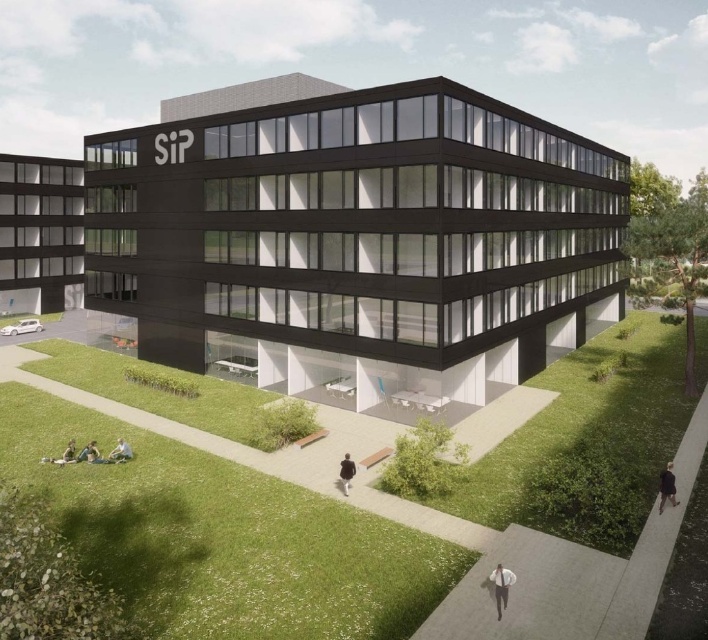
You are a window cleaner working on the black glass building at center. You need to reach the top of the green fabric at lower left to clean a window. Will you need a ladder to reach that height?

The black glass building at center is taller than the green fabric at lower left, so the window at the height of the green fabric at lower left is lower than the top of the building. Since you are already on the building, you can reach it without a ladder.

You are a photographer planning to capture a closeup of the SiP building name. You notice two items in the foreground that might distract the viewer. The white shirt at lower right and the green fabric at lower left. Which of these items is narrower in width?

The white shirt at lower right is thinner than the green fabric at lower left, so the white shirt at lower right is narrower in width.

You are an architect designing a new office building. You want to ensure that the black glass building at center does not overshadow the green fabric person at lower left in the final design. What adjustment could you make to the building to achieve this?

To prevent the black glass building at center from overshadowing the green fabric person at lower left, you could reduce the height of the black glass building at center so that it is no longer much taller than the green fabric person at lower left.